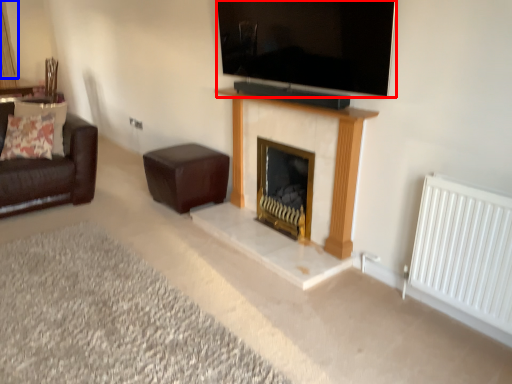
Question: Among these objects, which one is farthest to the camera, television (highlighted by a red box) or curtain (highlighted by a blue box)?

Choices:
 (A) television
 (B) curtain

Answer: (B)